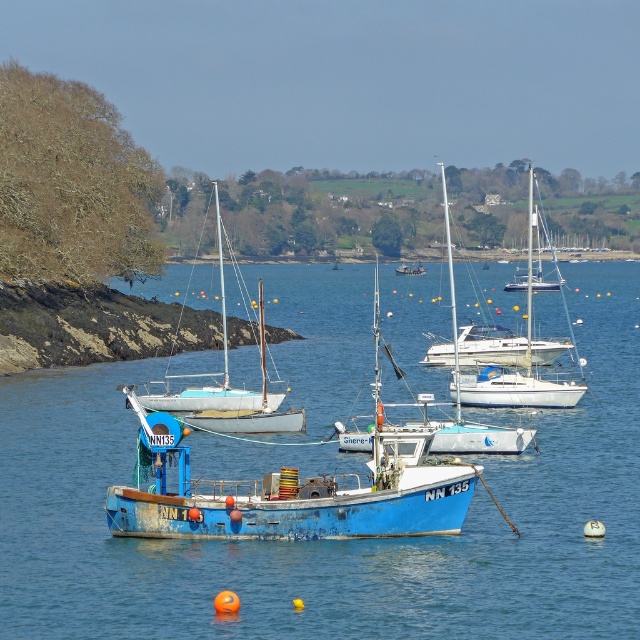
You are standing on the deck of the blue fishing boat labeled NN 135 and want to reach a specific point marked at coordinates point (570, 554). Based on the distance provided, can you safely walk to that point from your current position?

The point (570, 554) is 33.81 meters away from the viewer. Since the blue fishing boat labeled NN 135 is anchored and the water is calm, you can safely walk to that point from your current position as long as the distance is manageable for you.

You are a marine biologist observing the coastal scene. You need to determine the relative height of the blue painted water at center and the blue painted wooden fishing boat at center. Which one has a greater height?

The blue painted water at center is much taller than the blue painted wooden fishing boat at center according to the description.

What is the exact coordinate of the blue painted water at center?

The blue painted water at center is located at point (333, 540).